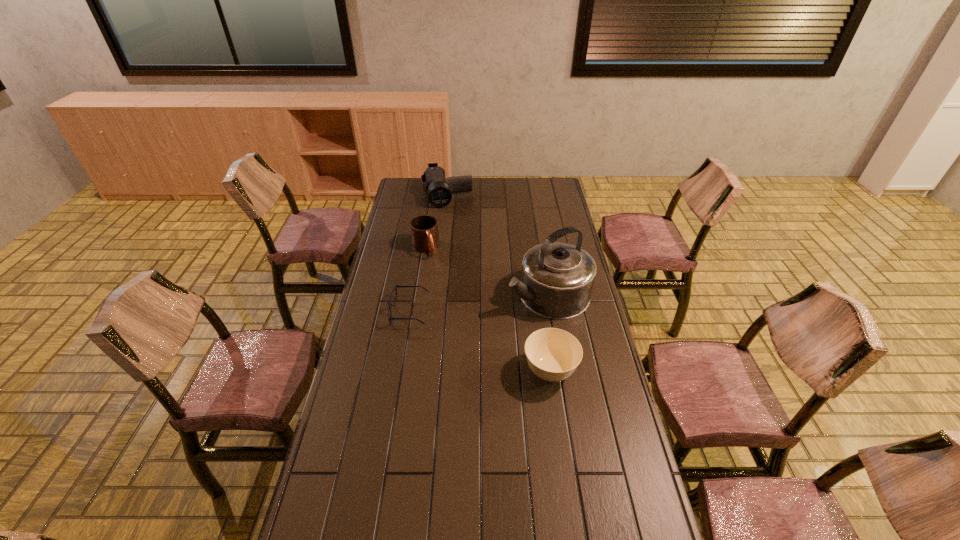
Identify the location of the shortest object. (389, 302).

At what (x,y) coordinates should I click in order to perform the action: click on sugar bowl. Please return your answer as a coordinate pair (x, y). Looking at the image, I should click on (552, 354).

Locate an element on the screen. This screenshot has width=960, height=540. camcorder is located at coordinates (439, 192).

You are a GUI agent. You are given a task and a screenshot of the screen. Output one action in this format:
    pyautogui.click(x=<x>, y=<y>)
    Task: Click on the kettle
    This screenshot has width=960, height=540.
    Given the screenshot: What is the action you would take?
    pyautogui.click(x=557, y=279)

Find the location of a particular element. the fourth nearest object is located at coordinates tap(424, 229).

Find the location of a particular element. free space located 0.050m on the front-facing side of the shortest object is located at coordinates (376, 312).

I want to click on vacant region located on the front of the sugar bowl, so click(x=555, y=408).

Where is `vacant region located on the lens of the camcorder`? The height and width of the screenshot is (540, 960). vacant region located on the lens of the camcorder is located at coordinates (459, 252).

The image size is (960, 540). Identify the location of vacant space located 0.070m on the lens of the camcorder. (451, 216).

Locate an element on the screen. free space located 0.220m on the lens of the camcorder is located at coordinates (455, 233).